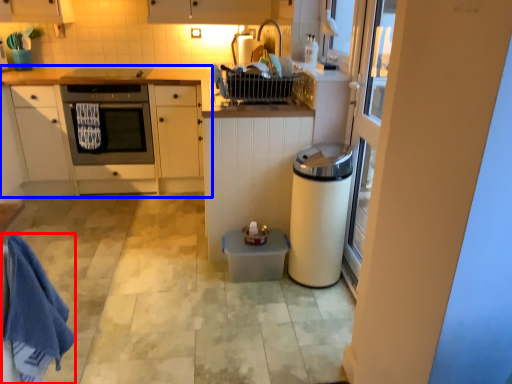
Question: Which object appears farthest to the camera in this image, bath towel (highlighted by a red box) or cabinetry (highlighted by a blue box)?

Choices:
 (A) bath towel
 (B) cabinetry

Answer: (B)